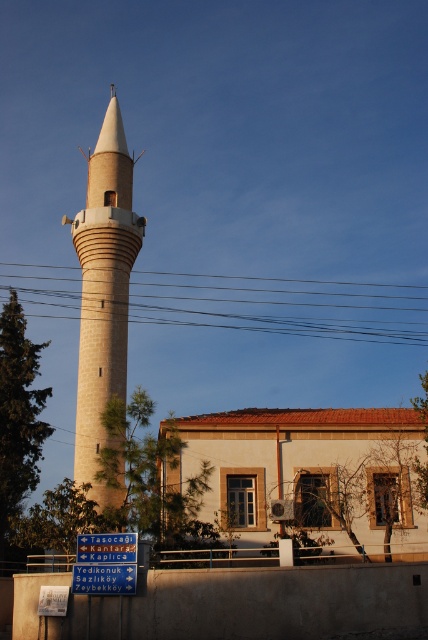
Who is shorter, beige stucco mosque at lower center or beige stone minaret at center?

With less height is beige stucco mosque at lower center.

Which is behind, point (413, 444) or point (133, 163)?

The point (133, 163) is more distant.

You are a GUI agent. You are given a task and a screenshot of the screen. Output one action in this format:
    pyautogui.click(x=<x>, y=<y>)
    Task: Click on the beige stucco mosque at lower center
    The image size is (428, 640).
    Given the screenshot: What is the action you would take?
    pyautogui.click(x=309, y=474)

Between beige stone minaret at center and brown wire at center, which one has more height?

beige stone minaret at center

Who is more distant from viewer, (115, 269) or (327, 314)?

The point (327, 314) is behind.

Where is `beige stone minaret at center`? This screenshot has height=640, width=428. beige stone minaret at center is located at coordinates (104, 292).

In order to click on beige stone minaret at center in this screenshot , I will do `click(104, 292)`.

How far apart are beige stucco mosque at lower center and brown wire at center?

They are 59.89 meters apart.

Looking at this image, measure the distance between point [300,440] and camera.

63.77 meters

Between point (412, 516) and point (68, 300), which one is positioned behind?

The point (68, 300) is more distant.

In order to click on beige stucco mosque at lower center in this screenshot , I will do `click(309, 474)`.